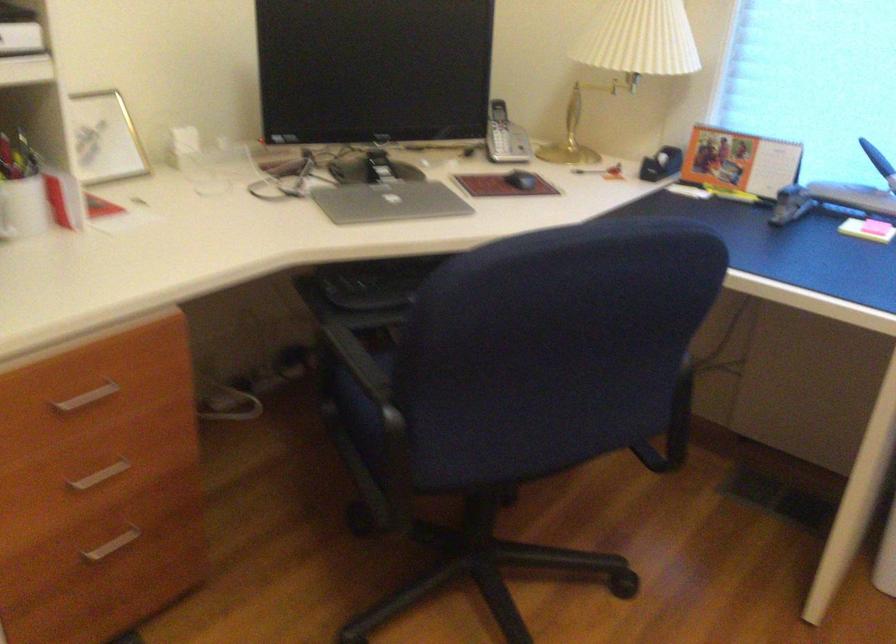
The width and height of the screenshot is (896, 644). Identify the location of black computer mouse. (521, 180).